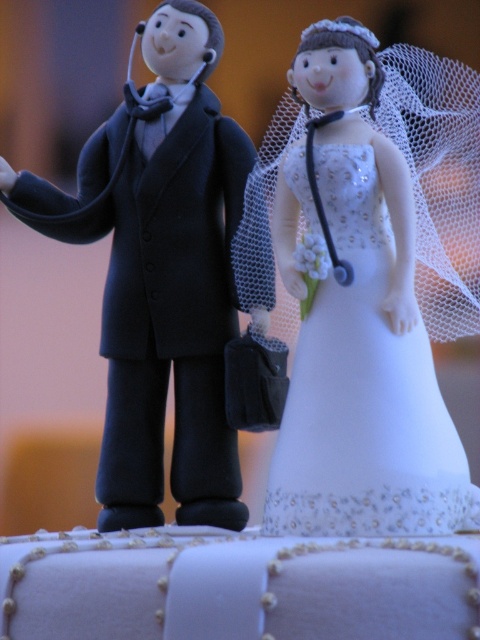
You are a photographer setting up a shot of the white glossy wedding dress at upper center. The camera is positioned so that the dress is in focus. If you want to include the groom figurine in the frame without moving the camera, will the groom figurine be in focus?

The white glossy wedding dress at upper center is 35.66 inches from camera. Since the groom figurine is not mentioned in the Objects Description, we cannot determine its distance from the camera. Therefore, it is uncertain if the groom figurine will be in focus.

You are a wedding planner arranging the cake toppers. The cake has a small platform at the top. You have the white glossy wedding dress at upper center and the matte black suit at left. Which topper should you place on the platform to ensure it fits properly?

The white glossy wedding dress at upper center is shorter than the matte black suit at left, so placing the white glossy wedding dress at upper center on the platform ensures it fits properly as it is shorter and less likely to topple over.